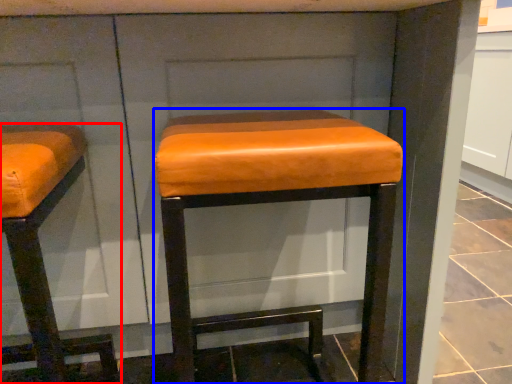
Question: Which of the following is the farthest to the observer, furniture (highlighted by a red box) or stool (highlighted by a blue box)?

Choices:
 (A) furniture
 (B) stool

Answer: (B)